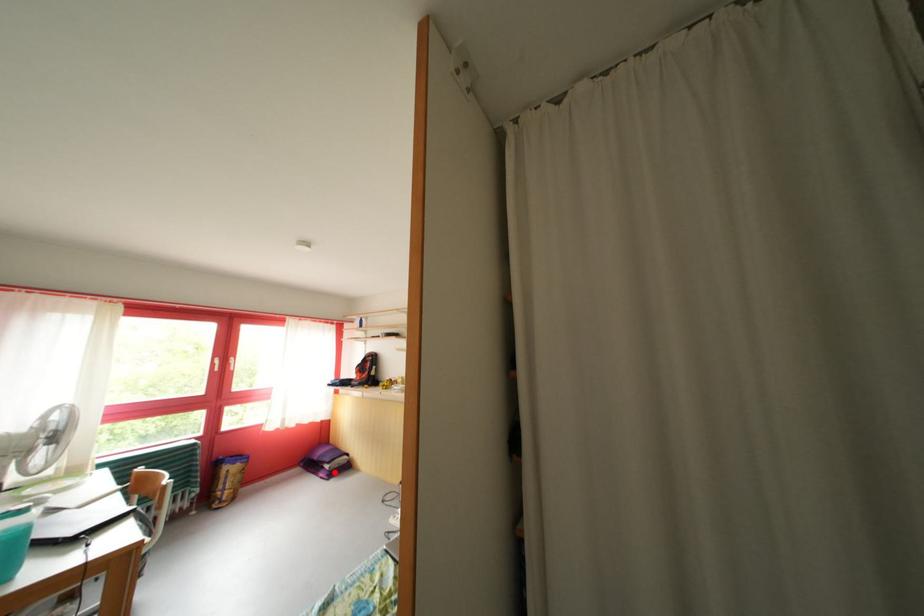
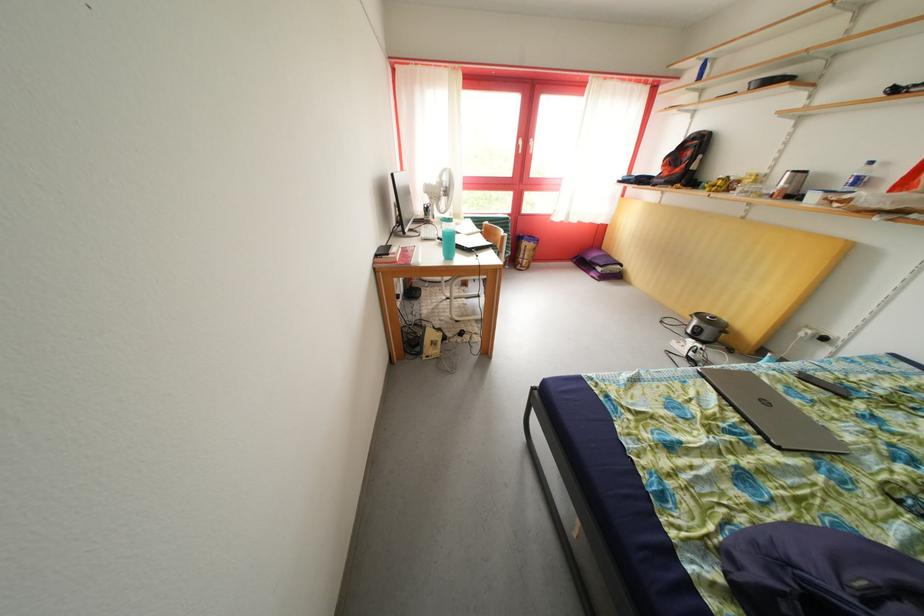
In the second image, find the point that corresponds to the highlighted location in the first image.

(608, 275)